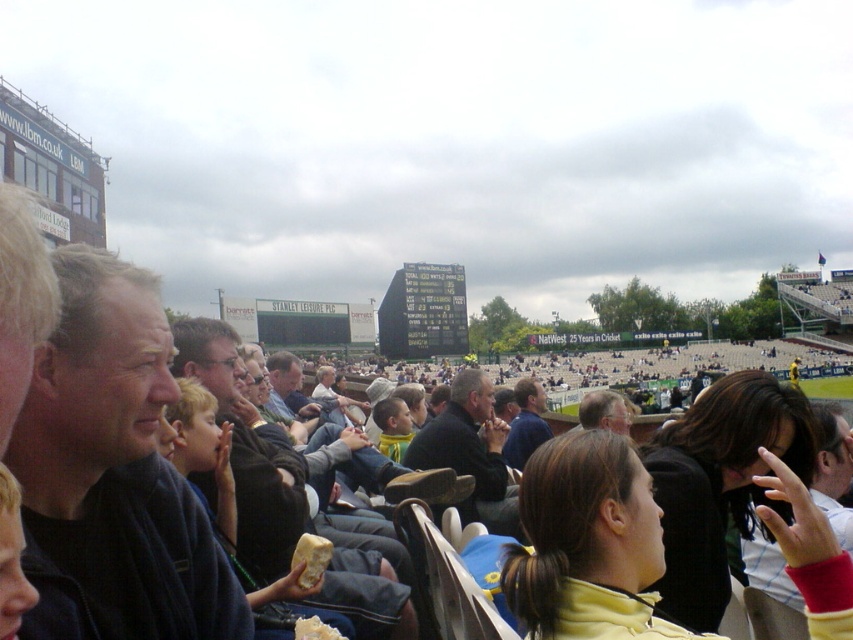
You are standing at the point with coordinates point (299, 545) and want to move towards the point with coordinates point (537, 406). Since you can only move forward, will you be moving closer to or farther from the front of the stadium?

The point (537, 406) is further to the viewer than point (299, 545). Moving towards point (537, 406) from point (299, 545) means you are moving closer to the front of the stadium because the destination is nearer to the viewer.

You are a photographer at the cricket match and want to take a photo of the dark blue shirt at center. Where should you aim your camera?

The dark blue shirt at center is located at coordinates 0.662 on the x axis and 0.618 on the y axis, so aim your camera there.

You are a photographer trying to capture a candid shot of the dark blue shirt at center without the yellow crumbly food at center blocking the view. Based on their heights, can you position yourself so that the food doesn

The dark blue shirt at center has a greater height compared to the yellow crumbly food at center, so positioning yourself at an angle where the shirt is elevated above the food should allow you to capture the shot without obstruction.